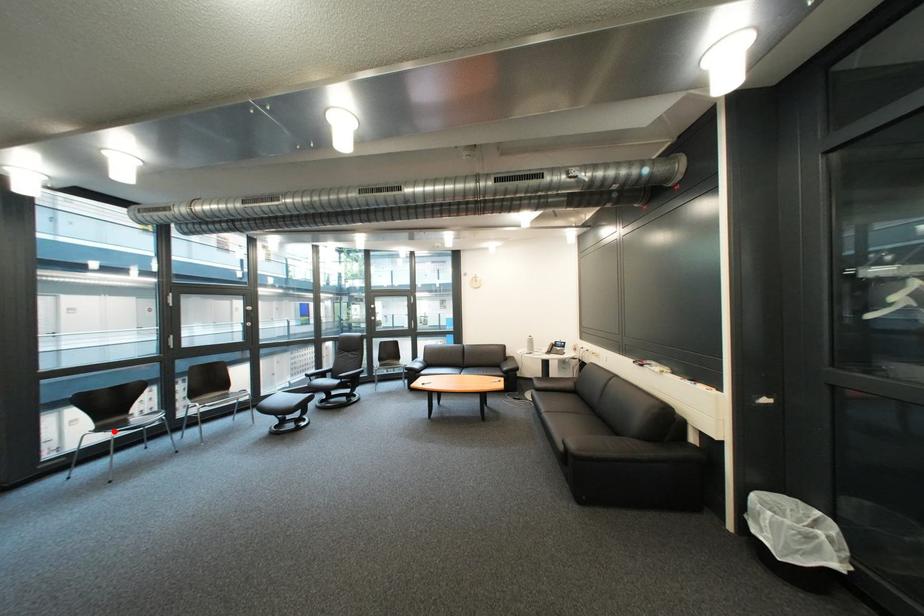
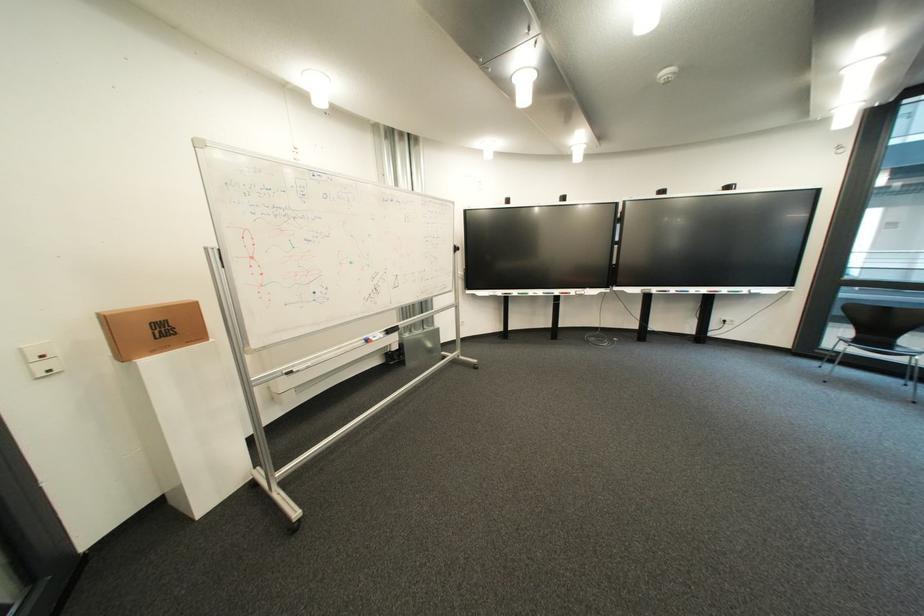
Find the pixel in the second image that matches the highlighted location in the first image.

(870, 342)